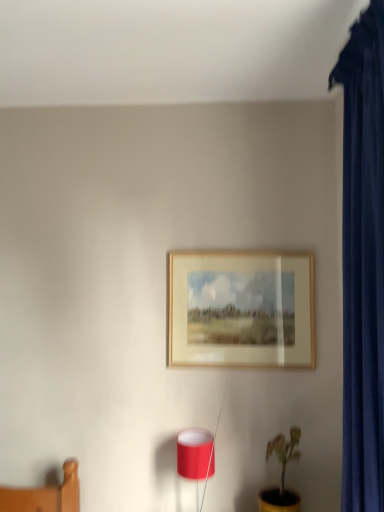
Question: From a real-world perspective, is wooden frame at center above or below matte red lampshade at lower center?

Choices:
 (A) below
 (B) above

Answer: (B)

Question: Considering the positions of wooden frame at center and matte red lampshade at lower center in the image, is wooden frame at center wider or thinner than matte red lampshade at lower center?

Choices:
 (A) wide
 (B) thin

Answer: (B)

Question: Estimate the real-world distances between objects in this image. Which object is closer to the yellow matte pot at lower right?

Choices:
 (A) matte red lampshade at lower center
 (B) wooden frame at center

Answer: (A)

Question: Which of these objects is positioned closest to the matte red lampshade at lower center?

Choices:
 (A) yellow matte pot at lower right
 (B) wooden frame at center

Answer: (A)